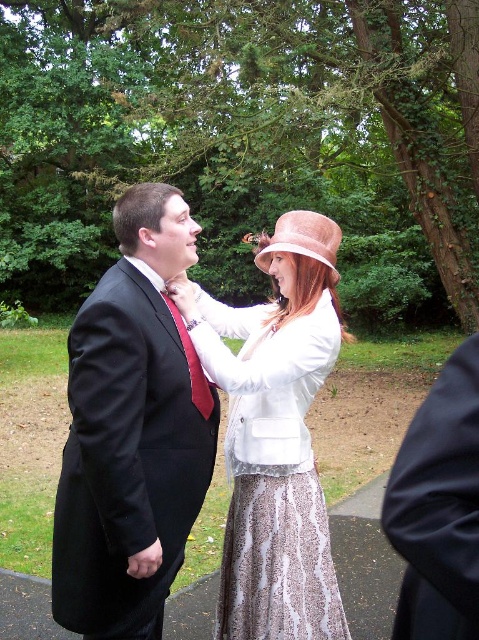
Question: Does black fabric coat at lower right appear over red satin tie at center?

Choices:
 (A) no
 (B) yes

Answer: (A)

Question: Which of the following is the closest to the observer?

Choices:
 (A) (262, 346)
 (B) (411, 449)
 (C) (208, 401)

Answer: (B)

Question: Which point is closer to the camera?

Choices:
 (A) (198, 381)
 (B) (117, 561)
 (C) (296, 248)

Answer: (B)

Question: Which point is closer to the camera taking this photo?

Choices:
 (A) (189, 445)
 (B) (322, 225)

Answer: (A)

Question: Does matte black suit at center have a smaller size compared to black fabric coat at lower right?

Choices:
 (A) yes
 (B) no

Answer: (B)

Question: Is black fabric coat at lower right smaller than light brown felt hat at upper center?

Choices:
 (A) no
 (B) yes

Answer: (A)